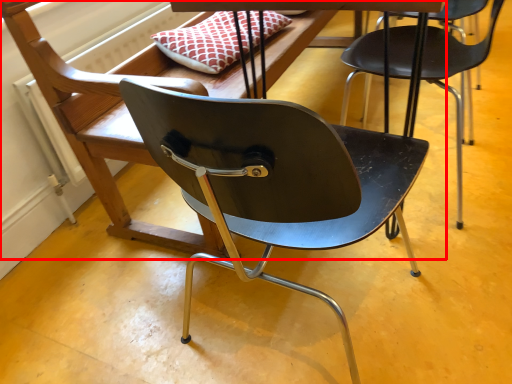
Question: Observing the image, what is the correct spatial positioning of chair (annotated by the red box) in reference to chair?

Choices:
 (A) right
 (B) left

Answer: (B)